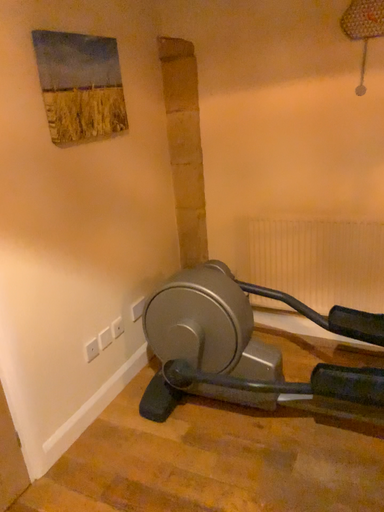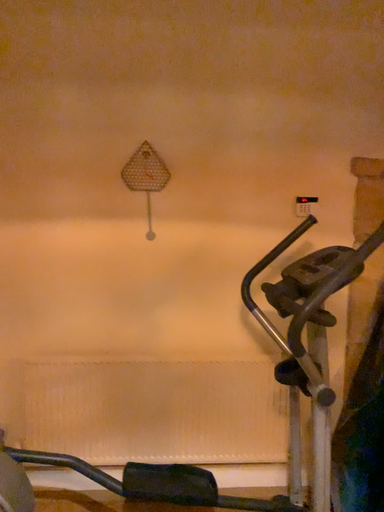
Question: How did the camera likely rotate when shooting the video?

Choices:
 (A) rotated right
 (B) rotated left

Answer: (A)